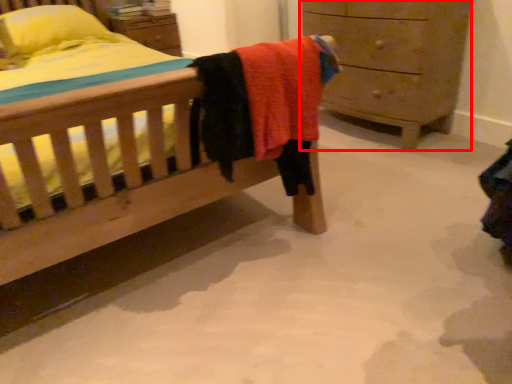
Question: From the image's perspective, considering the relative positions of chest of drawers (annotated by the red box) and pillow in the image provided, where is chest of drawers (annotated by the red box) located with respect to the staircase?

Choices:
 (A) above
 (B) below

Answer: (B)